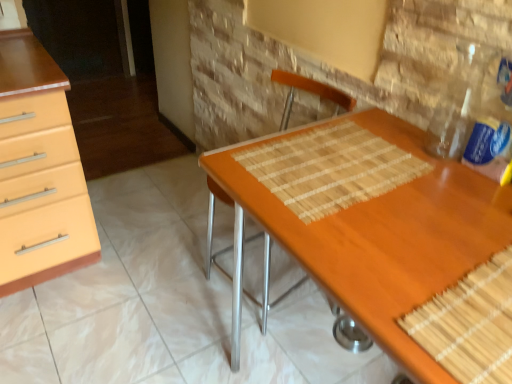
Question: Is bamboo placemat at center next to clear plastic bottle at upper right and touching it?

Choices:
 (A) yes
 (B) no

Answer: (B)

Question: From a real-world perspective, is bamboo placemat at center over clear plastic bottle at upper right?

Choices:
 (A) yes
 (B) no

Answer: (B)

Question: Is bamboo placemat at center at the left side of clear plastic bottle at upper right?

Choices:
 (A) yes
 (B) no

Answer: (A)

Question: Does bamboo placemat at center have a lesser width compared to clear plastic bottle at upper right?

Choices:
 (A) yes
 (B) no

Answer: (B)

Question: Does bamboo placemat at center come behind clear plastic bottle at upper right?

Choices:
 (A) yes
 (B) no

Answer: (A)

Question: Based on their positions, is clear plastic bottle at upper right located to the left or right of orange woven fabric chair at center?

Choices:
 (A) right
 (B) left

Answer: (A)

Question: From the image's perspective, relative to orange woven fabric chair at center, is clear plastic bottle at upper right above or below?

Choices:
 (A) below
 (B) above

Answer: (B)

Question: Considering their positions, is clear plastic bottle at upper right located in front of or behind orange woven fabric chair at center?

Choices:
 (A) front
 (B) behind

Answer: (A)

Question: Is clear plastic bottle at upper right situated inside orange woven fabric chair at center or outside?

Choices:
 (A) inside
 (B) outside

Answer: (B)

Question: From the image's perspective, is orange woven fabric chair at center positioned above or below clear plastic bottle at upper right?

Choices:
 (A) above
 (B) below

Answer: (B)

Question: Which is correct: orange woven fabric chair at center is inside clear plastic bottle at upper right, or outside of it?

Choices:
 (A) outside
 (B) inside

Answer: (A)

Question: Visually, is orange woven fabric chair at center positioned to the left or to the right of clear plastic bottle at upper right?

Choices:
 (A) left
 (B) right

Answer: (A)

Question: Is point (272, 81) closer or farther from the camera than point (454, 150)?

Choices:
 (A) closer
 (B) farther

Answer: (B)

Question: Considering their positions, is bamboo placemat at center located in front of or behind wooden desk at center?

Choices:
 (A) front
 (B) behind

Answer: (B)

Question: Considering the positions of point (404, 165) and point (415, 261), is point (404, 165) closer or farther from the camera than point (415, 261)?

Choices:
 (A) farther
 (B) closer

Answer: (A)